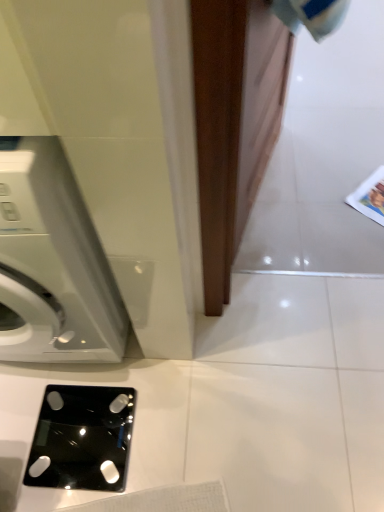
Describe the element at coordinates (82, 438) in the screenshot. I see `black glass scale at lower center` at that location.

Measure the distance between point (93,485) and camera.

The depth of point (93,485) is 3.84 feet.

This screenshot has height=512, width=384. Find the location of `black glass scale at lower center`. black glass scale at lower center is located at coordinates (82, 438).

You are a GUI agent. You are given a task and a screenshot of the screen. Output one action in this format:
    pyautogui.click(x=<x>, y=<y>)
    Task: Click on the white glossy washing machine at left
    The height and width of the screenshot is (512, 384).
    Given the screenshot: What is the action you would take?
    pyautogui.click(x=52, y=263)

The image size is (384, 512). What do you see at coordinates (52, 263) in the screenshot? I see `white glossy washing machine at left` at bounding box center [52, 263].

You are a GUI agent. You are given a task and a screenshot of the screen. Output one action in this format:
    pyautogui.click(x=<x>, y=<y>)
    Task: Click on the black glass scale at lower center
    
    Given the screenshot: What is the action you would take?
    pyautogui.click(x=82, y=438)

Is white glossy washing machine at left to the left or to the right of black glass scale at lower center in the image?

From the image, it's evident that white glossy washing machine at left is to the left of black glass scale at lower center.

In the image, is white glossy washing machine at left positioned in front of or behind black glass scale at lower center?

Clearly, white glossy washing machine at left is in front of black glass scale at lower center.

Which is farther from the camera, (x=116, y=306) or (x=38, y=474)?

Point (x=116, y=306)

From the image's perspective, does white glossy washing machine at left appear lower than black glass scale at lower center?

No, from the image's perspective, white glossy washing machine at left is not beneath black glass scale at lower center.

From a real-world perspective, is white glossy washing machine at left positioned under black glass scale at lower center based on gravity?

Incorrect, from a real-world perspective, white glossy washing machine at left is higher than black glass scale at lower center.

Does white glossy washing machine at left have a lesser width compared to black glass scale at lower center?

No.

Between white glossy washing machine at left and black glass scale at lower center, which one has less height?

black glass scale at lower center is shorter.

Considering the relative sizes of white glossy washing machine at left and black glass scale at lower center in the image provided, is white glossy washing machine at left smaller than black glass scale at lower center?

Actually, white glossy washing machine at left might be larger than black glass scale at lower center.

Is white glossy washing machine at left situated inside black glass scale at lower center or outside?

white glossy washing machine at left exists outside the volume of black glass scale at lower center.

Is white glossy washing machine at left not near black glass scale at lower center?

white glossy washing machine at left is near black glass scale at lower center, not far away.

Is white glossy washing machine at left oriented away from black glass scale at lower center?

No, white glossy washing machine at left is not facing the opposite direction of black glass scale at lower center.

Can you tell me how much white glossy washing machine at left and black glass scale at lower center differ in facing direction?

They differ by 2.46e-05 degrees in their facing directions.

Identify the location of ipod on the right of white glossy washing machine at left. (82, 438).

Considering the positions of objects black glass scale at lower center and white glossy washing machine at left in the image provided, who is more to the left, black glass scale at lower center or white glossy washing machine at left?

Positioned to the left is white glossy washing machine at left.

Is black glass scale at lower center closer to the viewer compared to white glossy washing machine at left?

No, black glass scale at lower center is behind white glossy washing machine at left.

Is point (62, 432) positioned after point (105, 341)?

Yes, point (62, 432) is behind point (105, 341).

From the image's perspective, is black glass scale at lower center located above or below white glossy washing machine at left?

Clearly, from the image's perspective, black glass scale at lower center is below white glossy washing machine at left.

From a real-world perspective, is black glass scale at lower center above or below white glossy washing machine at left?

black glass scale at lower center is situated lower than white glossy washing machine at left in the real world.

Considering the relative sizes of black glass scale at lower center and white glossy washing machine at left in the image provided, is black glass scale at lower center thinner than white glossy washing machine at left?

Indeed, black glass scale at lower center has a lesser width compared to white glossy washing machine at left.

Between black glass scale at lower center and white glossy washing machine at left, which one has less height?

Standing shorter between the two is black glass scale at lower center.

Considering the relative sizes of black glass scale at lower center and white glossy washing machine at left in the image provided, is black glass scale at lower center bigger than white glossy washing machine at left?

Actually, black glass scale at lower center might be smaller than white glossy washing machine at left.

Choose the correct answer: Is black glass scale at lower center inside white glossy washing machine at left or outside it?

black glass scale at lower center exists outside the volume of white glossy washing machine at left.

Are black glass scale at lower center and white glossy washing machine at left located far from each other?

No, there isn't a large distance between black glass scale at lower center and white glossy washing machine at left.

Is black glass scale at lower center facing towards white glossy washing machine at left?

No, black glass scale at lower center is not turned towards white glossy washing machine at left.

What's the angular difference between black glass scale at lower center and white glossy washing machine at left's facing directions?

black glass scale at lower center and white glossy washing machine at left are facing 2.46e-05 degrees away from each other.

From the picture: How far apart are black glass scale at lower center and white glossy washing machine at left?

They are 14.64 inches apart.

Locate an element on the screen. Image resolution: width=384 pixels, height=512 pixels. ipod below the white glossy washing machine at left (from a real-world perspective) is located at coordinates (82, 438).

The height and width of the screenshot is (512, 384). Find the location of `washing machine that is on the left side of black glass scale at lower center`. washing machine that is on the left side of black glass scale at lower center is located at coordinates (52, 263).

The image size is (384, 512). Identify the location of ipod behind the white glossy washing machine at left. (82, 438).